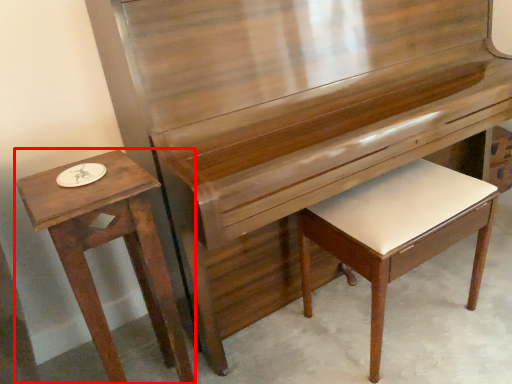
Question: From the image's perspective, what is the correct spatial positioning of table (annotated by the red box) in reference to music stool?

Choices:
 (A) below
 (B) above

Answer: (A)